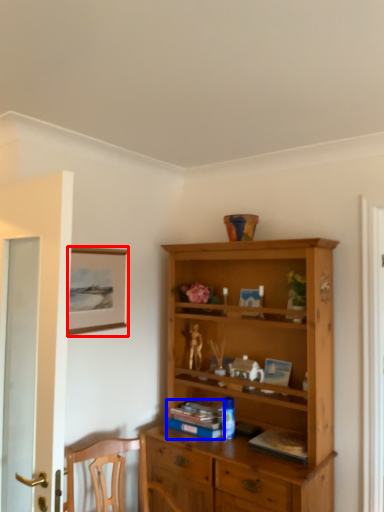
Question: Which point is further to the camera, picture frame (highlighted by a red box) or book (highlighted by a blue box)?

Choices:
 (A) picture frame
 (B) book

Answer: (B)